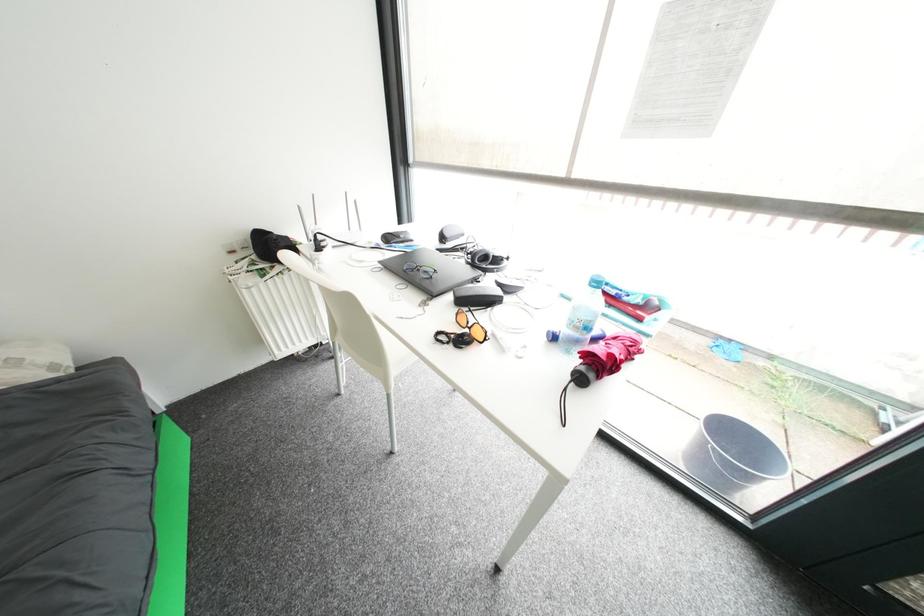
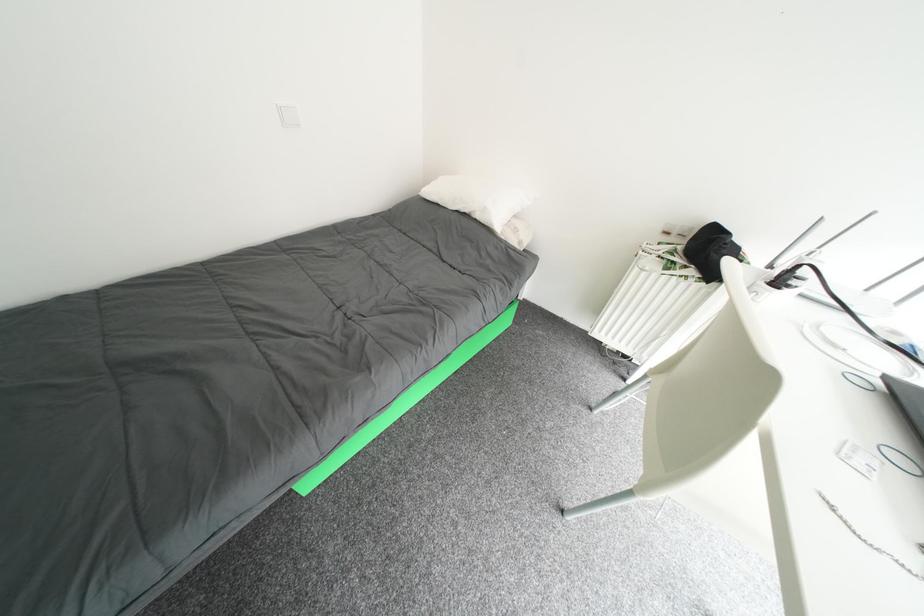
The first image is from the beginning of the video and the second image is from the end. How did the camera likely rotate when shooting the video?

The rotation direction of the camera is left-down.